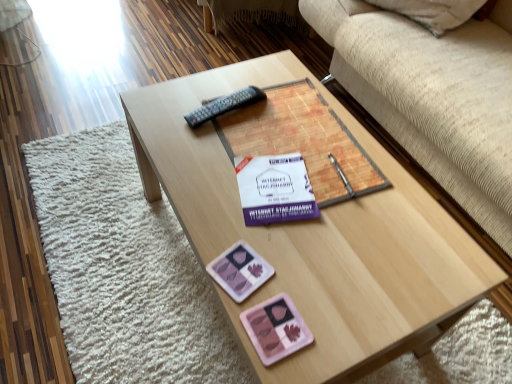
Where is `vacant space that is in between white paper at center and pink matte palette at center, which ranks as the second currency in top-to-bottom order`? The image size is (512, 384). vacant space that is in between white paper at center and pink matte palette at center, which ranks as the second currency in top-to-bottom order is located at coordinates (285, 262).